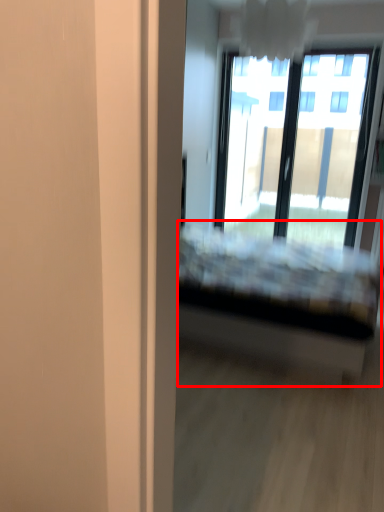
Question: From the image's perspective, where is bed (annotated by the red box) located in relation to window in the image?

Choices:
 (A) below
 (B) above

Answer: (A)